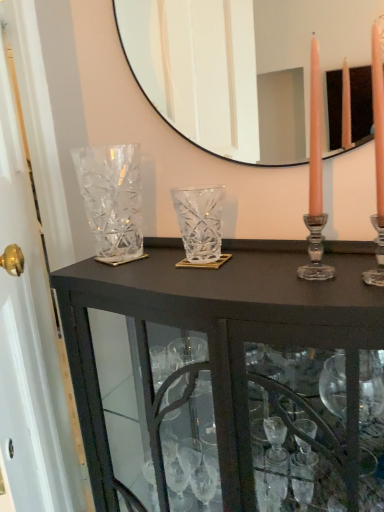
Question: Is clear crystal vase at left, the first glass vase viewed from the left, located outside clear glass mirror at upper center?

Choices:
 (A) no
 (B) yes

Answer: (B)

Question: Is clear crystal vase at left, arranged as the 2th glass vase when viewed from the right, aimed at clear glass mirror at upper center?

Choices:
 (A) yes
 (B) no

Answer: (B)

Question: Is clear crystal vase at left, arranged as the 2th glass vase when viewed from the right, next to clear glass mirror at upper center and touching it?

Choices:
 (A) yes
 (B) no

Answer: (B)

Question: Can you confirm if clear crystal vase at left, the first glass vase viewed from the left, is taller than clear glass mirror at upper center?

Choices:
 (A) no
 (B) yes

Answer: (A)

Question: Does clear crystal vase at left, the first glass vase viewed from the left, have a greater width compared to clear glass mirror at upper center?

Choices:
 (A) yes
 (B) no

Answer: (A)

Question: Based on their positions, is clear crystal vase at center, which is the 1th glass vase in right-to-left order, located to the left or right of clear crystal vase at left, arranged as the 2th glass vase when viewed from the right?

Choices:
 (A) right
 (B) left

Answer: (A)

Question: From the image's perspective, relative to clear crystal vase at left, arranged as the 2th glass vase when viewed from the right, is clear crystal vase at center, the 2th glass vase when ordered from left to right, above or below?

Choices:
 (A) above
 (B) below

Answer: (B)

Question: Is clear crystal vase at center, the 2th glass vase when ordered from left to right, in front of or behind clear crystal vase at left, arranged as the 2th glass vase when viewed from the right, in the image?

Choices:
 (A) behind
 (B) front

Answer: (B)

Question: Based on their sizes in the image, would you say clear crystal vase at center, the 2th glass vase when ordered from left to right, is bigger or smaller than clear crystal vase at left, the first glass vase viewed from the left?

Choices:
 (A) small
 (B) big

Answer: (A)

Question: From a real-world perspective, is clear crystal vase at left, the first glass vase viewed from the left, above or below clear glass cabinet at center?

Choices:
 (A) below
 (B) above

Answer: (B)

Question: From the image's perspective, is clear crystal vase at left, arranged as the 2th glass vase when viewed from the right, located above or below clear glass cabinet at center?

Choices:
 (A) below
 (B) above

Answer: (B)

Question: Relative to clear glass cabinet at center, is clear crystal vase at left, the first glass vase viewed from the left, in front or behind?

Choices:
 (A) front
 (B) behind

Answer: (B)

Question: Considering the positions of point (129, 242) and point (223, 349), is point (129, 242) closer or farther from the camera than point (223, 349)?

Choices:
 (A) closer
 (B) farther

Answer: (B)

Question: Is clear glass mirror at upper center in front of or behind clear crystal vase at left, the first glass vase viewed from the left, in the image?

Choices:
 (A) behind
 (B) front

Answer: (B)

Question: Is clear glass mirror at upper center spatially inside clear crystal vase at left, the first glass vase viewed from the left, or outside of it?

Choices:
 (A) outside
 (B) inside

Answer: (A)